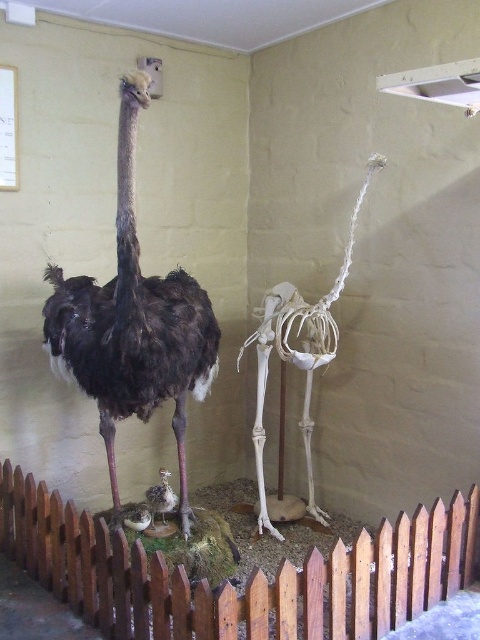
Does dark brown feathers at center appear on the left side of brown feathered chick at center?

Correct, you'll find dark brown feathers at center to the left of brown feathered chick at center.

The width and height of the screenshot is (480, 640). What do you see at coordinates (132, 323) in the screenshot?
I see `dark brown feathers at center` at bounding box center [132, 323].

Locate an element on the screen. dark brown feathers at center is located at coordinates (132, 323).

Does point (463, 500) lie in front of point (148, 492)?

That is True.

This screenshot has width=480, height=640. Identify the location of brown wooden picket fence at lower center. (249, 579).

Can you confirm if brown wooden picket fence at lower center is thinner than dark brown feathers at center?

In fact, brown wooden picket fence at lower center might be wider than dark brown feathers at center.

Which of these two, brown wooden picket fence at lower center or dark brown feathers at center, stands taller?

dark brown feathers at center

This screenshot has height=640, width=480. Find the location of `brown wooden picket fence at lower center`. brown wooden picket fence at lower center is located at coordinates (249, 579).

Where is `brown wooden picket fence at lower center`? brown wooden picket fence at lower center is located at coordinates (249, 579).